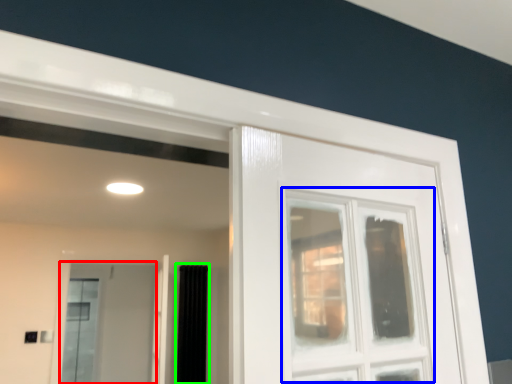
Question: Which object is the closest to the screen door (highlighted by a red box)? Choose among these: window (highlighted by a blue box) or curtain (highlighted by a green box).

Choices:
 (A) window
 (B) curtain

Answer: (B)